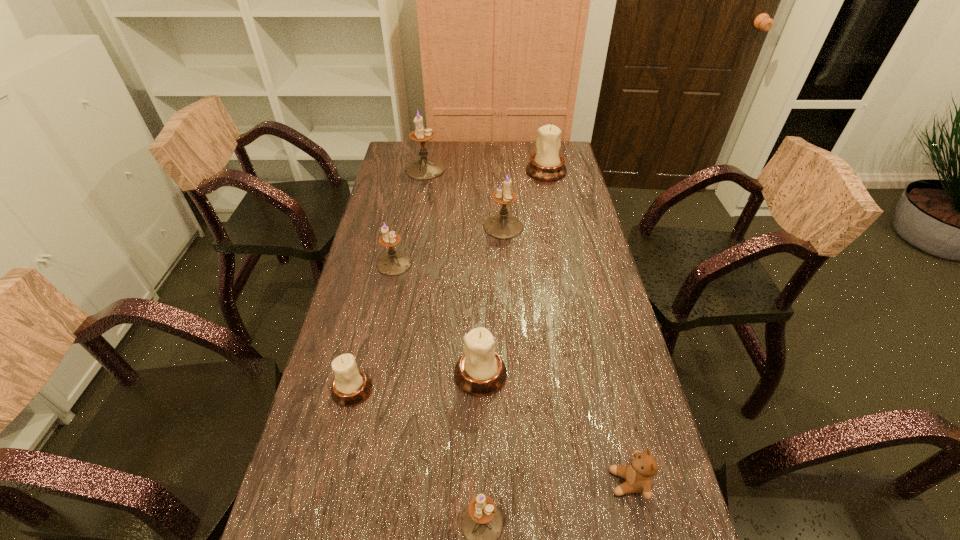
At what (x,y) coordinates should I click in order to perform the action: click on teddy bear. Please return your answer as a coordinate pair (x, y). This screenshot has width=960, height=540. Looking at the image, I should click on (639, 473).

The width and height of the screenshot is (960, 540). Find the location of `vacant region located on the right of the farthest purple candle holder`. vacant region located on the right of the farthest purple candle holder is located at coordinates (486, 169).

Locate an element on the screen. The width and height of the screenshot is (960, 540). free point located 0.060m on the back of the rightmost white candle holder is located at coordinates (542, 154).

This screenshot has width=960, height=540. What are the coordinates of `vacant space located 0.090m on the left of the third nearest purple candle holder` in the screenshot? It's located at (458, 227).

In order to click on free region located on the back of the second white candle holder from left to right in this screenshot , I will do `click(481, 284)`.

Identify the location of vacant space located on the right of the third biggest purple candle holder. The width and height of the screenshot is (960, 540). (520, 264).

Locate an element on the screen. This screenshot has width=960, height=540. vacant position located 0.350m on the right of the smallest white candle holder is located at coordinates (514, 389).

What are the coordinates of `vacant space situated on the front-facing side of the brown teddy bear` in the screenshot? It's located at (587, 482).

The width and height of the screenshot is (960, 540). I want to click on free space located on the front-facing side of the brown teddy bear, so click(x=454, y=482).

This screenshot has height=540, width=960. What are the coordinates of `free space located 0.080m on the front-facing side of the brown teddy bear` in the screenshot? It's located at (573, 482).